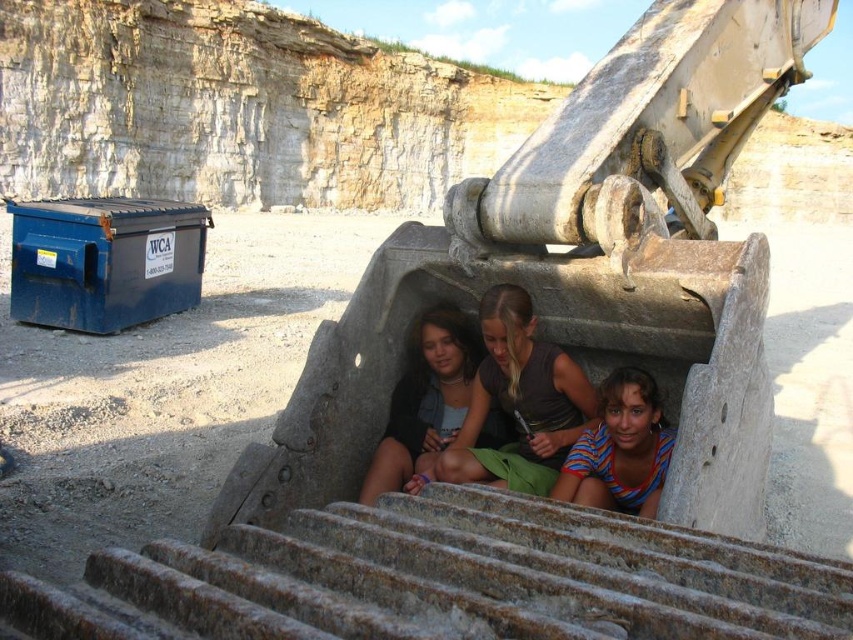
Between striped fabric shirt at center and matte black shirt at center, which one appears on the left side from the viewer's perspective?

From the viewer's perspective, matte black shirt at center appears more on the left side.

Which is in front, point (514, 298) or point (442, 440)?

Point (514, 298) is in front.

Image resolution: width=853 pixels, height=640 pixels. What are the coordinates of `striped fabric shirt at center` in the screenshot? It's located at (519, 401).

Looking at this image, can you confirm if striped fabric shirt at center is smaller than striped cotton shirt at lower center?

Indeed, striped fabric shirt at center has a smaller size compared to striped cotton shirt at lower center.

Does striped fabric shirt at center appear on the right side of striped cotton shirt at lower center?

No, striped fabric shirt at center is not to the right of striped cotton shirt at lower center.

Describe the element at coordinates (519, 401) in the screenshot. I see `striped fabric shirt at center` at that location.

I want to click on striped fabric shirt at center, so tap(519, 401).

Does rusty metal stairs at lower center appear under striped cotton shirt at lower center?

Yes.

Between rusty metal stairs at lower center and striped cotton shirt at lower center, which one appears on the right side from the viewer's perspective?

striped cotton shirt at lower center is more to the right.

Between point (334, 547) and point (627, 445), which one is positioned in front?

Point (334, 547) is in front.

Find the location of a particular element. This screenshot has height=640, width=853. rusty metal stairs at lower center is located at coordinates (444, 579).